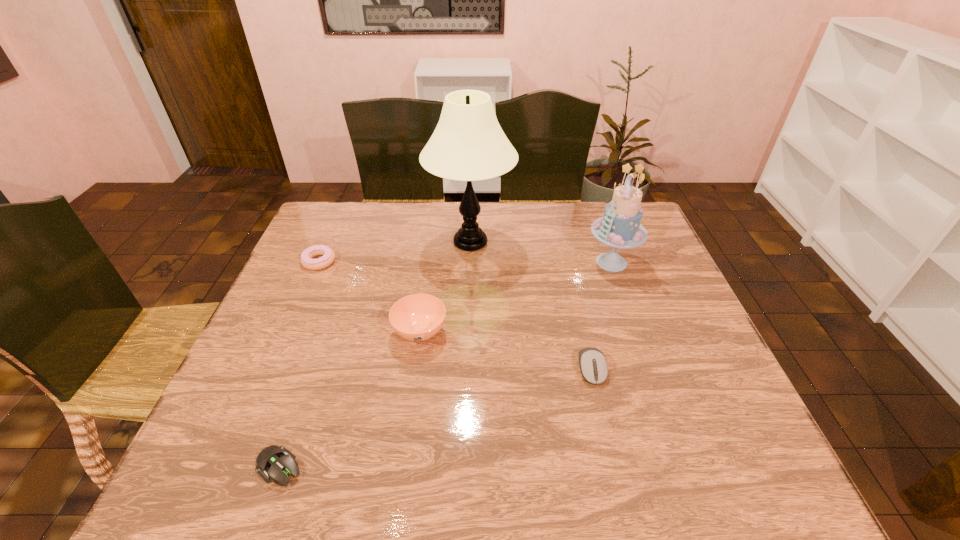
The height and width of the screenshot is (540, 960). I want to click on vacant area that lies between the doughnut and the left computer mouse, so click(300, 364).

Image resolution: width=960 pixels, height=540 pixels. Find the location of `vacant space that is in between the shorter computer mouse and the taller computer mouse`. vacant space that is in between the shorter computer mouse and the taller computer mouse is located at coordinates (436, 417).

At what (x,y) coordinates should I click in order to perform the action: click on free space that is in between the nearer computer mouse and the lamp. Please return your answer as a coordinate pair (x, y). Image resolution: width=960 pixels, height=540 pixels. Looking at the image, I should click on (375, 354).

The image size is (960, 540). I want to click on free space between the rightmost object and the leftmost object, so click(466, 262).

Find the location of a particular element. Image resolution: width=960 pixels, height=540 pixels. vacant space that's between the shorter computer mouse and the lamp is located at coordinates (375, 354).

The height and width of the screenshot is (540, 960). I want to click on empty location between the tallest object and the shortest object, so click(x=375, y=354).

Identify the location of unoccupied position between the fourth shortest object and the leftmost object. (370, 296).

The image size is (960, 540). Find the location of `blank region between the right computer mouse and the lamp`. blank region between the right computer mouse and the lamp is located at coordinates (531, 306).

Choose which object is the second nearest neighbor to the farther computer mouse. Please provide its 2D coordinates. Your answer should be formatted as a tuple, i.e. [(x, y)], where the tuple contains the x and y coordinates of a point satisfying the conditions above.

[(418, 317)]

Point out which object is positioned as the fifth nearest to the farther computer mouse. Please provide its 2D coordinates. Your answer should be formatted as a tuple, i.e. [(x, y)], where the tuple contains the x and y coordinates of a point satisfying the conditions above.

[(328, 257)]